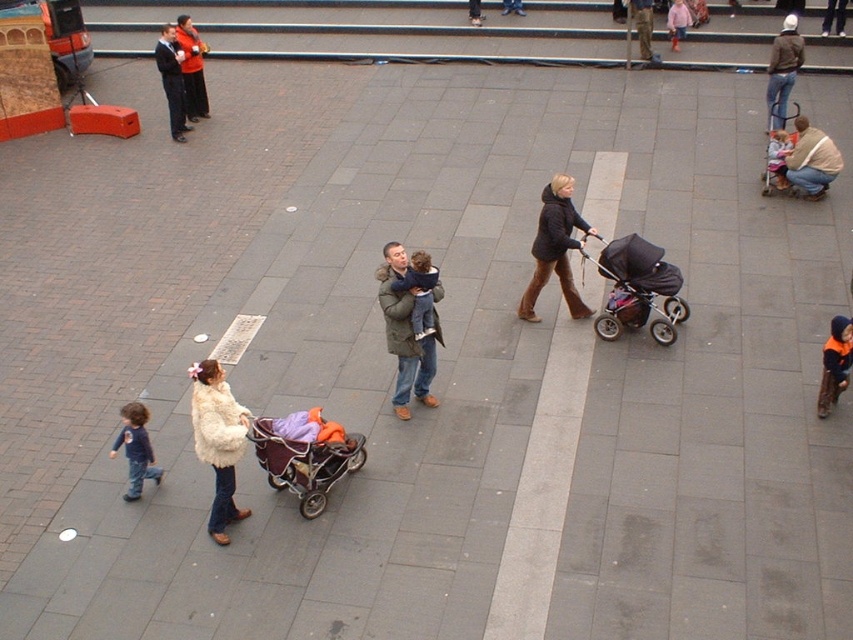
You are a pedestrian standing in the public square. You see the velvet purple baby carriage at center and the matte green coat at center. Which object is closer to you?

The velvet purple baby carriage at center is closer to you because it is in front of the matte green coat at center.

You are standing at the point marked by the coordinates point (x=637, y=289) in the plaza. What object are you standing at?

You are standing at the black fabric stroller at center, as the point (x=637, y=289) represents its location.

Please provide the 2D coordinates of the black fabric stroller at center in the image. The coordinates should be in the format of a point with two decimal places, such as 0.45, 0.75.

The 2D coordinates of the black fabric stroller at center are at point (x=637, y=289).